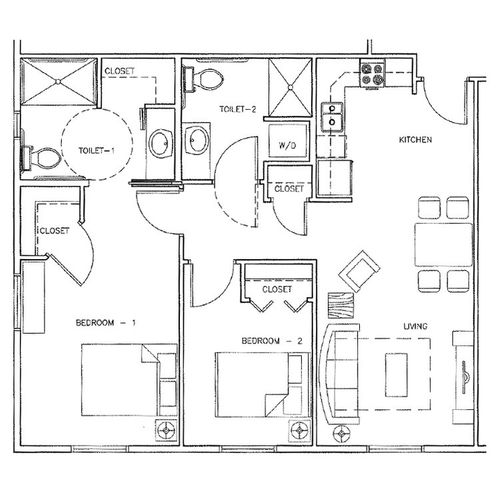
The width and height of the screenshot is (500, 500). Find the location of `kitchen area`. kitchen area is located at coordinates (375, 108), (433, 148), (386, 176).